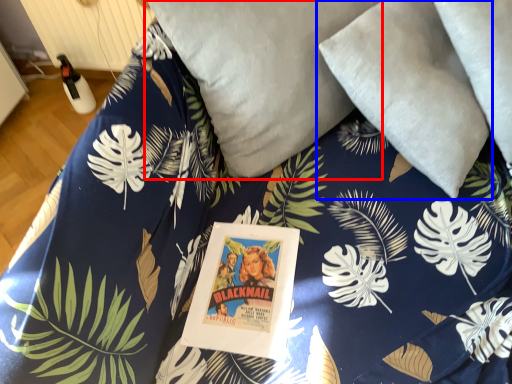
Question: Which of the following is the closest to the observer, pillow (highlighted by a red box) or pillow (highlighted by a blue box)?

Choices:
 (A) pillow
 (B) pillow

Answer: (B)